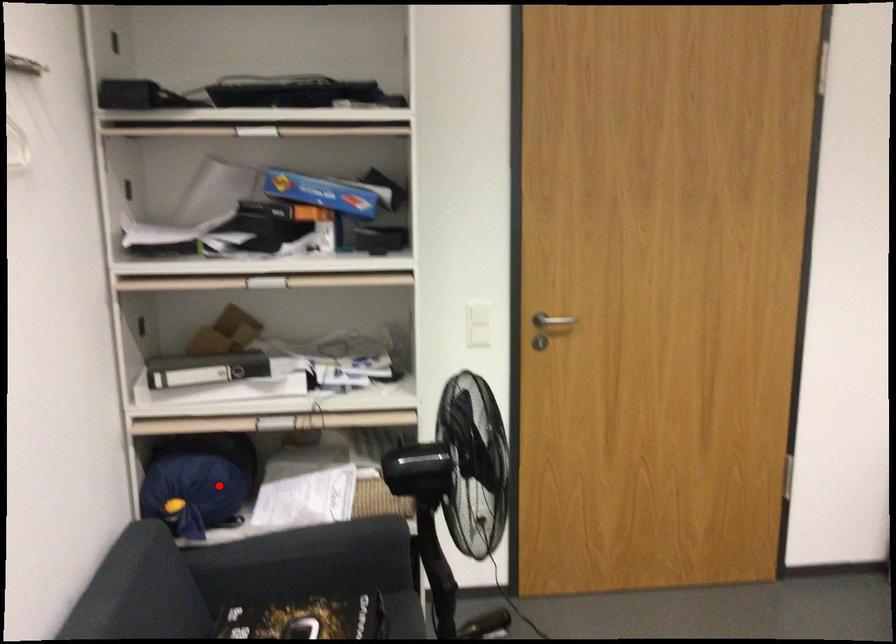
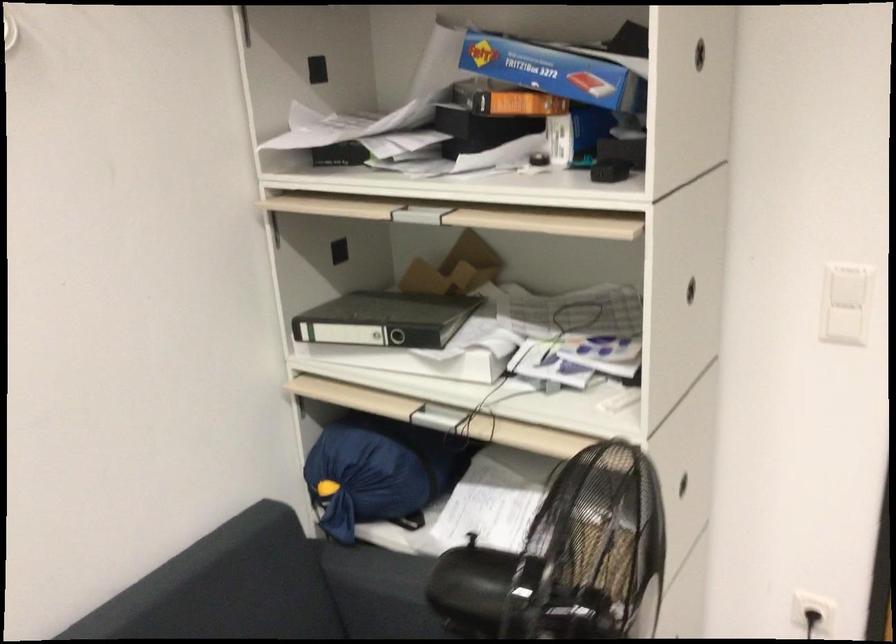
Question: A red point is marked in image1. In image2, is the corresponding 3D point closer to the camera or farther? Reply with the corresponding letter.

Choices:
 (A) The corresponding 3D point is closer.
 (B) The corresponding 3D point is farther.

Answer: (A)